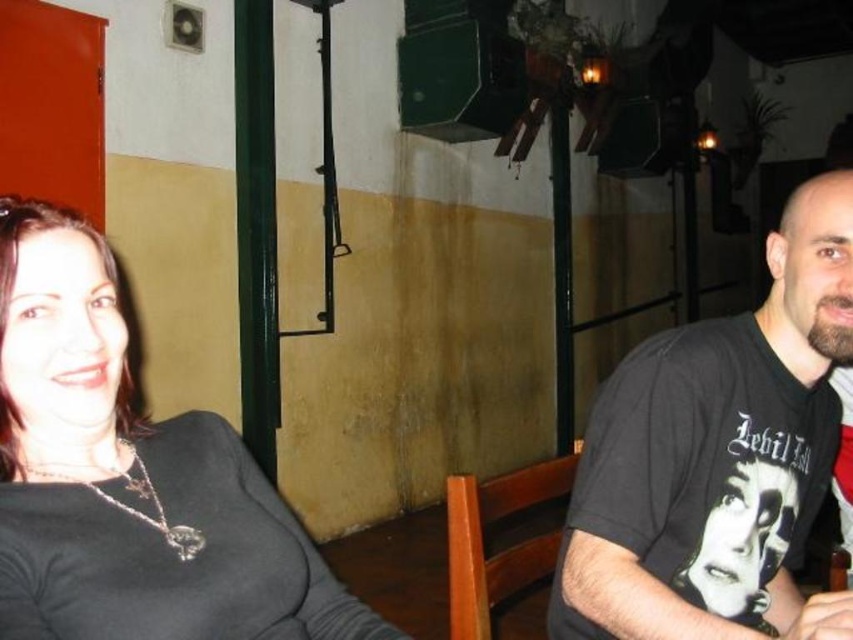
You are standing in the room and see the point at coordinates (x=129, y=477). Which object is this point located on?

The point at coordinates (x=129, y=477) is located on the matte black shirt at left.